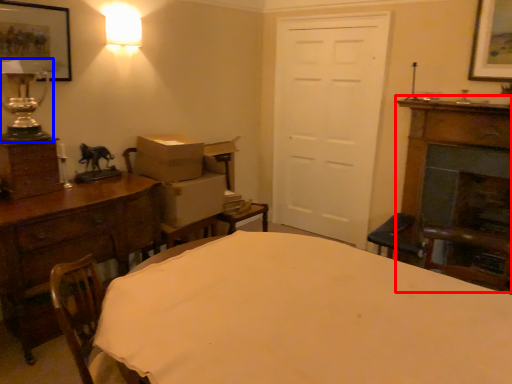
Question: Among these objects, which one is nearest to the camera, fireplace (highlighted by a red box) or table lamp (highlighted by a blue box)?

Choices:
 (A) fireplace
 (B) table lamp

Answer: (B)